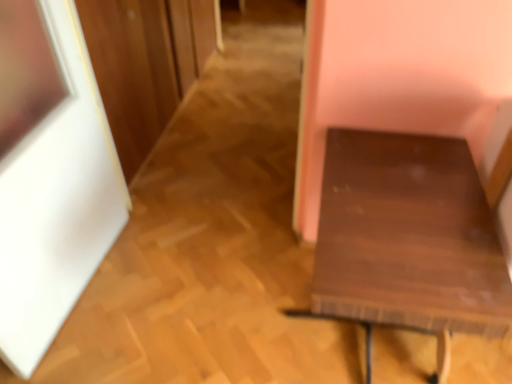
Locate an element on the screen. vacant area that lies to the right of white matte picture frame at left is located at coordinates (180, 291).